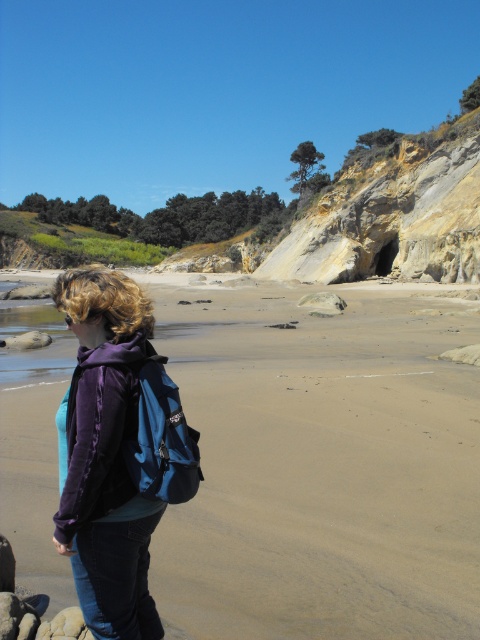
Between brown sandy beach at lower center and purple fleece jacket at lower left, which one appears on the right side from the viewer's perspective?

From the viewer's perspective, purple fleece jacket at lower left appears more on the right side.

Between point (363, 611) and point (79, 356), which one is positioned behind?

Positioned behind is point (363, 611).

Who is more forward, (388, 600) or (119, 278)?

Positioned in front is point (119, 278).

The image size is (480, 640). I want to click on brown sandy beach at lower center, so click(323, 465).

Is brown sandy beach at lower center thinner than smooth gray rock at center?

No.

Which is more to the right, brown sandy beach at lower center or smooth gray rock at center?

From the viewer's perspective, smooth gray rock at center appears more on the right side.

Where is `brown sandy beach at lower center`? brown sandy beach at lower center is located at coordinates (323, 465).

Is purple fleece jacket at lower left shorter than smooth gray rock at center?

In fact, purple fleece jacket at lower left may be taller than smooth gray rock at center.

Measure the distance between purple fleece jacket at lower left and smooth gray rock at center.

purple fleece jacket at lower left and smooth gray rock at center are 115.40 feet apart from each other.

Who is more distant from viewer, (105,637) or (302,296)?

The point (302,296) is behind.

Find the location of a particular element. The width and height of the screenshot is (480, 640). purple fleece jacket at lower left is located at coordinates (107, 456).